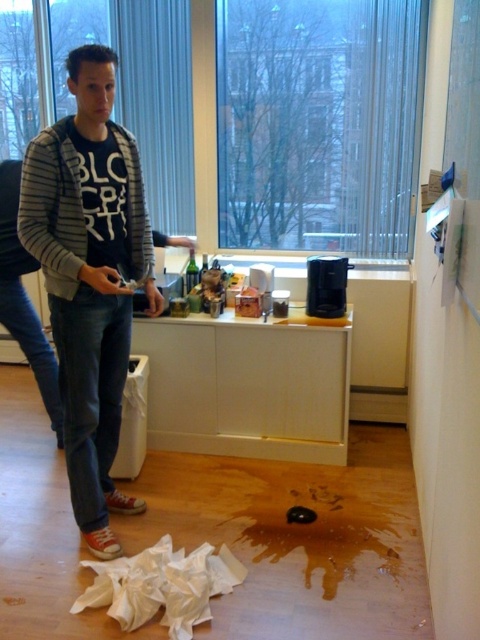
Question: Which object is closer to the camera taking this photo?

Choices:
 (A) white crumpled toilet paper at lower left
 (B) striped cotton shirt at upper left
 (C) white matte toilet paper at center

Answer: (A)

Question: Which object is positioned farthest from the striped cotton shirt at upper left?

Choices:
 (A) white matte toilet paper at center
 (B) white crumpled toilet paper at lower left

Answer: (A)

Question: From the image, what is the correct spatial relationship of striped cotton shirt at upper left in relation to white matte toilet paper at center?

Choices:
 (A) left
 (B) right

Answer: (A)

Question: Which is farther from the white crumpled toilet paper at lower left?

Choices:
 (A) white matte toilet paper at center
 (B) striped cotton shirt at upper left

Answer: (A)

Question: Can you confirm if striped cotton shirt at upper left is thinner than white matte toilet paper at center?

Choices:
 (A) yes
 (B) no

Answer: (B)

Question: Does striped cotton shirt at upper left appear over white matte toilet paper at center?

Choices:
 (A) yes
 (B) no

Answer: (B)